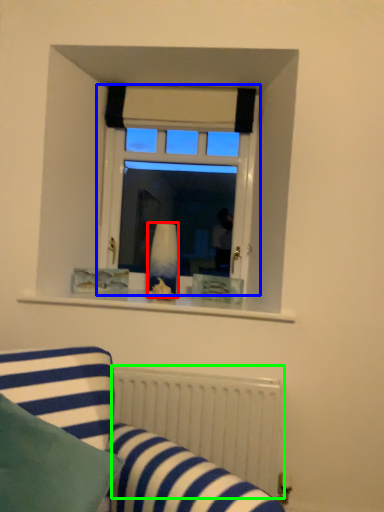
Question: Based on their relative distances, which object is farther from vase (highlighted by a red box)? Choose from window (highlighted by a blue box) and radiator (highlighted by a green box).

Choices:
 (A) window
 (B) radiator

Answer: (B)